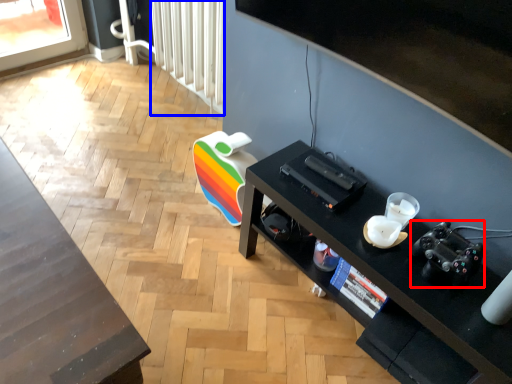
Question: Among these objects, which one is nearest to the camera, video camera (highlighted by a red box) or radiator (highlighted by a blue box)?

Choices:
 (A) video camera
 (B) radiator

Answer: (A)